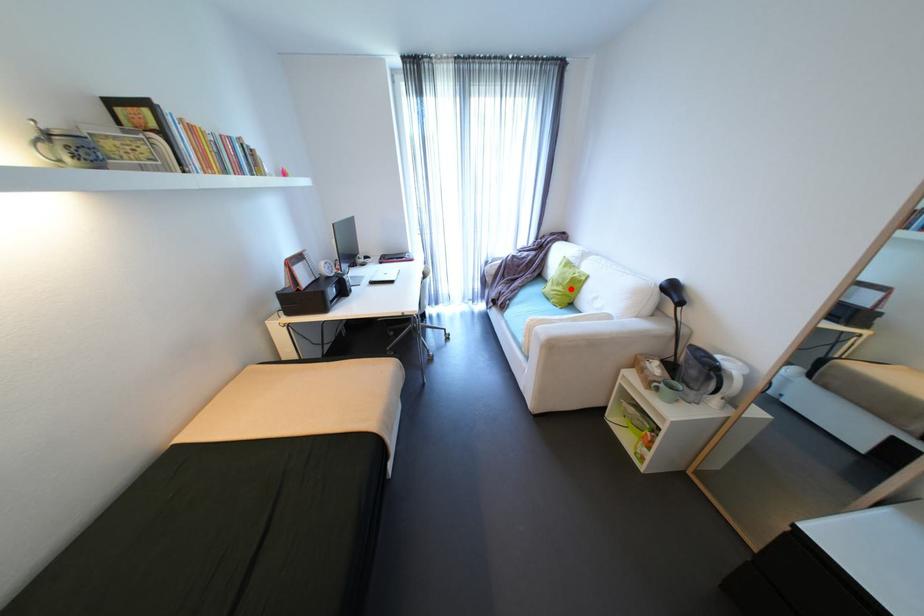
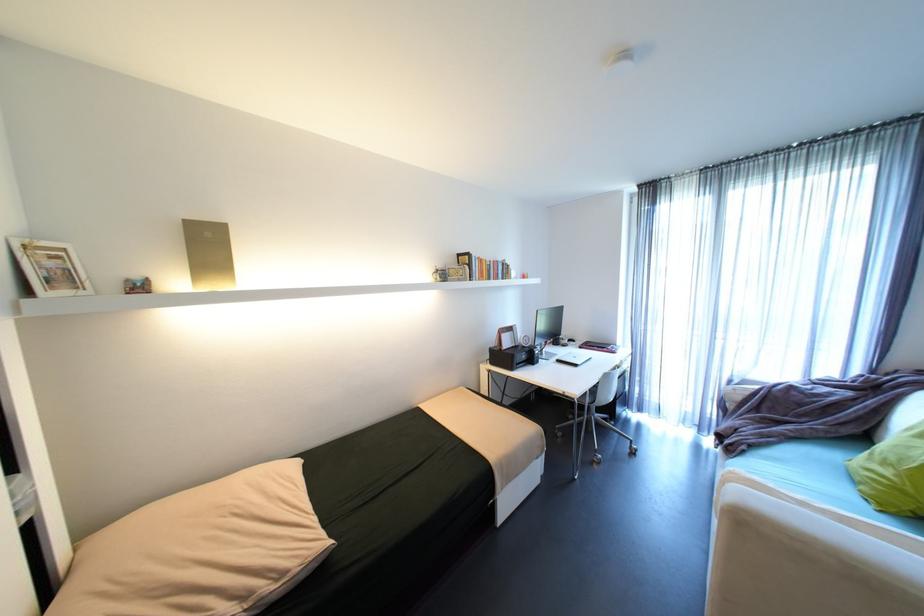
Question: I am providing you with two images of the same scene from different viewpoints. Image1 has a red point marked. In image2, the corresponding 3D location appears at what relative position? Reply with the corresponding letter.

Choices:
 (A) Closer
 (B) Farther

Answer: (B)